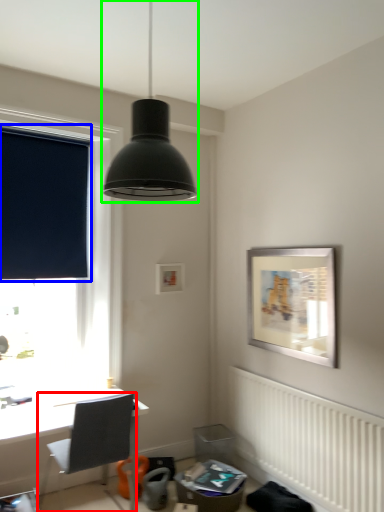
Question: Which object is positioned farthest from chair (highlighted by a red box)? Select from window screen (highlighted by a blue box) and lamp (highlighted by a green box).

Choices:
 (A) window screen
 (B) lamp

Answer: (B)